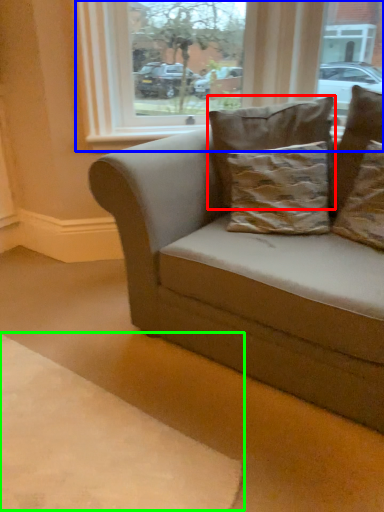
Question: Estimate the real-world distances between objects in this image. Which object is farther from pillow (highlighted by a red box), window (highlighted by a blue box) or dog bed (highlighted by a green box)?

Choices:
 (A) window
 (B) dog bed

Answer: (B)